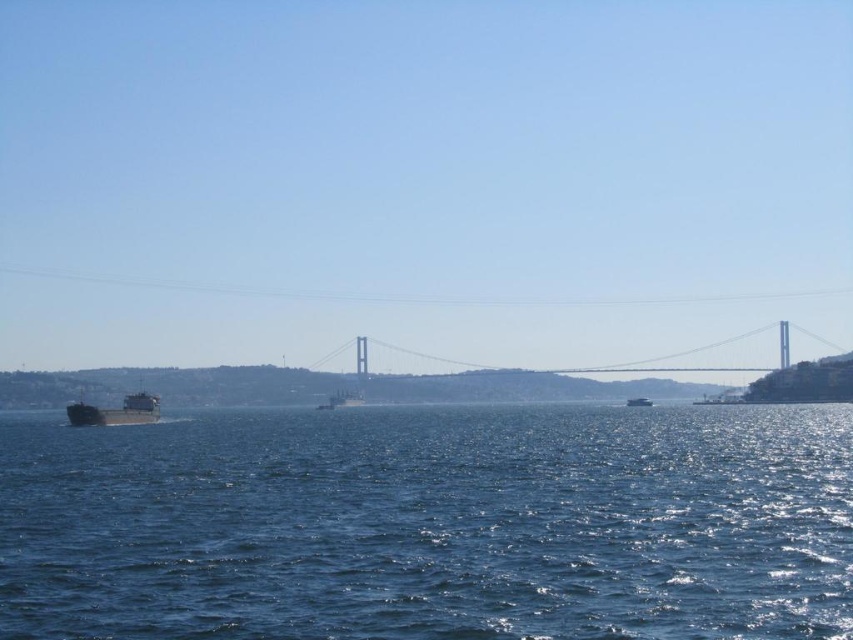
Can you confirm if metallic gray cargo ship at left is positioned to the left of metallic silver boat at center?

Indeed, metallic gray cargo ship at left is positioned on the left side of metallic silver boat at center.

Between metallic gray cargo ship at left and metallic silver boat at center, which one has less height?

metallic silver boat at center is shorter.

What do you see at coordinates (115, 412) in the screenshot? I see `metallic gray cargo ship at left` at bounding box center [115, 412].

The width and height of the screenshot is (853, 640). Find the location of `metallic gray cargo ship at left`. metallic gray cargo ship at left is located at coordinates (115, 412).

Can you confirm if metallic gray bridge at center is shorter than metallic silver boat at center?

Incorrect, metallic gray bridge at center's height does not fall short of metallic silver boat at center's.

Based on the photo, between metallic gray bridge at center and metallic silver boat at center, which one is positioned lower?

metallic silver boat at center is below.

The width and height of the screenshot is (853, 640). What are the coordinates of `metallic gray bridge at center` in the screenshot? It's located at (624, 362).

This screenshot has height=640, width=853. Find the location of `metallic gray bridge at center`. metallic gray bridge at center is located at coordinates (624, 362).

Does metallic gray bridge at center have a lesser height compared to metallic gray cargo ship at left?

No.

Does metallic gray bridge at center have a lesser width compared to metallic gray cargo ship at left?

No, metallic gray bridge at center is not thinner than metallic gray cargo ship at left.

Is point (477, 368) closer to camera compared to point (155, 410)?

No, (477, 368) is further to viewer.

Locate an element on the screen. metallic gray bridge at center is located at coordinates (624, 362).